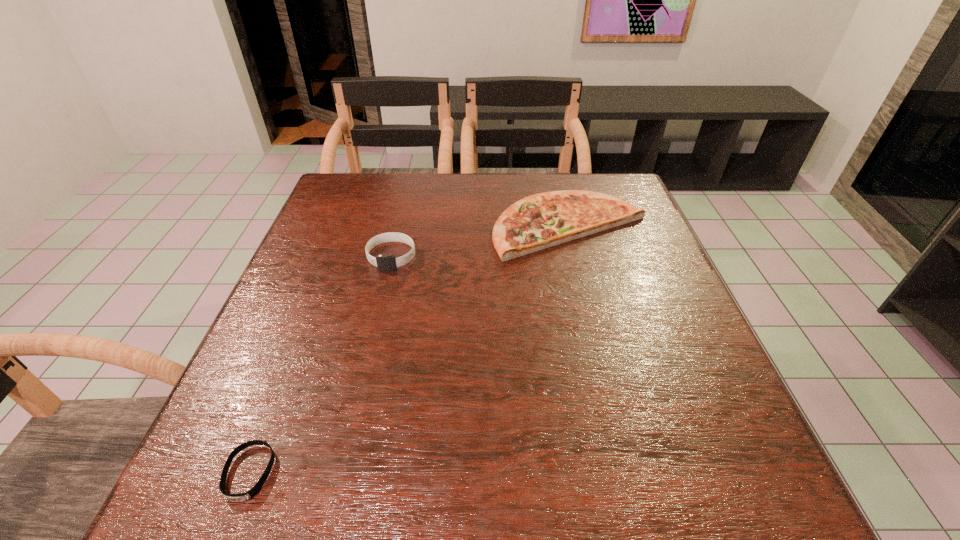
This screenshot has height=540, width=960. I want to click on free space between the pizza and the nearest object, so click(x=410, y=349).

The height and width of the screenshot is (540, 960). I want to click on unoccupied area between the shortest object and the second object from right to left, so click(x=321, y=364).

This screenshot has width=960, height=540. I want to click on vacant space that is in between the taller wristband and the nearer wristband, so click(321, 364).

The image size is (960, 540). I want to click on free space between the pizza and the shorter wristband, so click(x=410, y=349).

At what (x,y) coordinates should I click in order to perform the action: click on free space between the taller wristband and the nearest object. Please return your answer as a coordinate pair (x, y). Looking at the image, I should click on (321, 364).

In order to click on free point between the taller wristband and the pizza in this screenshot , I will do `click(481, 241)`.

Image resolution: width=960 pixels, height=540 pixels. I want to click on empty space between the nearest object and the pizza, so click(410, 349).

Find the location of `free space that is in between the left wristband and the pizza`. free space that is in between the left wristband and the pizza is located at coordinates (410, 349).

Identify the location of free spot between the rightmost object and the farther wristband. This screenshot has width=960, height=540. (481, 241).

Point out which object is positioned as the nearest to the pizza. Please provide its 2D coordinates. Your answer should be formatted as a tuple, i.e. [(x, y)], where the tuple contains the x and y coordinates of a point satisfying the conditions above.

[(384, 262)]